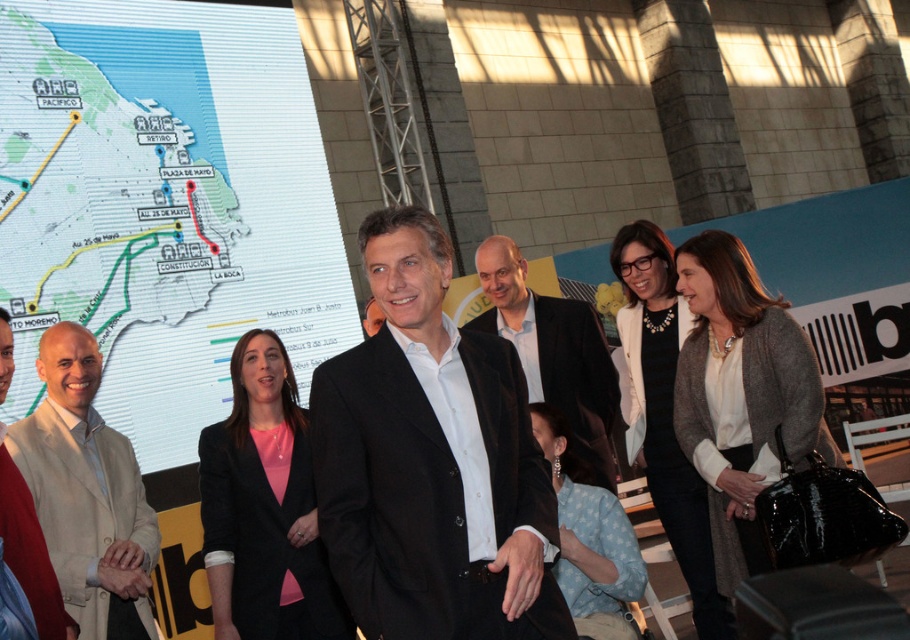
Does matte map at upper left come behind matte black blazer at center?

Yes, matte map at upper left is behind matte black blazer at center.

Is point (145, 193) more distant than point (240, 532)?

Yes, point (145, 193) is behind point (240, 532).

The image size is (910, 640). What do you see at coordinates (164, 204) in the screenshot?
I see `matte map at upper left` at bounding box center [164, 204].

The height and width of the screenshot is (640, 910). What are the coordinates of `matte map at upper left` in the screenshot? It's located at (164, 204).

Is black glossy suit at center to the left of velvet black suit at center from the viewer's perspective?

Yes, black glossy suit at center is to the left of velvet black suit at center.

Can you confirm if black glossy suit at center is taller than velvet black suit at center?

Indeed, black glossy suit at center has a greater height compared to velvet black suit at center.

Who is more forward, (346,355) or (511,253)?

Point (346,355) is more forward.

Where is `black glossy suit at center`? black glossy suit at center is located at coordinates (431, 461).

Is matte black blazer at center to the left of velvet black suit at center from the viewer's perspective?

Indeed, matte black blazer at center is positioned on the left side of velvet black suit at center.

Between point (244, 627) and point (494, 259), which one is positioned behind?

Point (494, 259)

Find the location of a particular element. The width and height of the screenshot is (910, 640). matte black blazer at center is located at coordinates (263, 532).